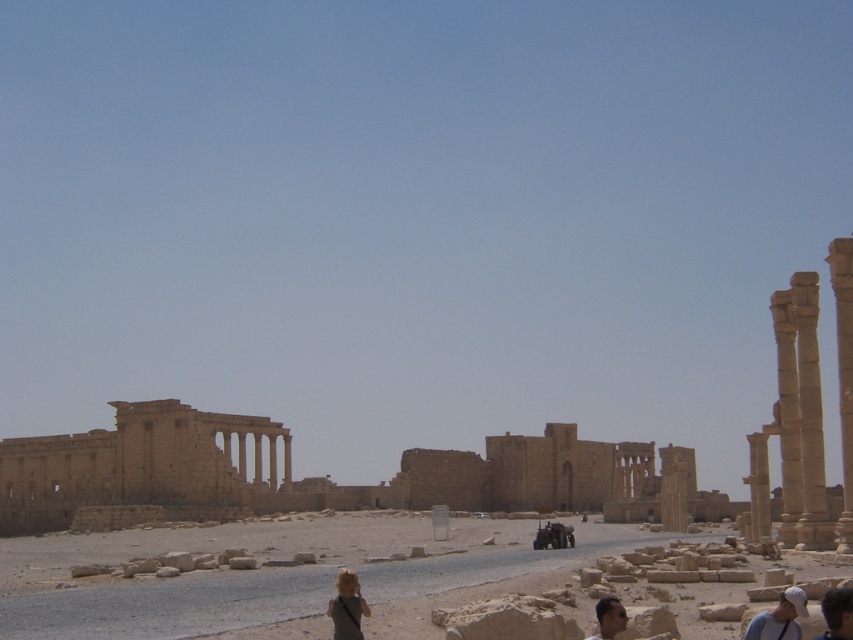
Can you confirm if beige stone ruins at left is bigger than light brown leather cap at lower right?

Yes.

Is point (120, 499) positioned behind point (750, 621)?

That is True.

The height and width of the screenshot is (640, 853). In order to click on beige stone ruins at left in this screenshot , I will do `click(137, 470)`.

Does point (770, 634) come behind point (824, 637)?

No, (770, 634) is closer to viewer.

Between light brown leather cap at lower right and dark hair at lower right, which one is positioned higher?

dark hair at lower right is above.

Does point (778, 624) come in front of point (831, 611)?

No, it is not.

Image resolution: width=853 pixels, height=640 pixels. I want to click on light brown leather cap at lower right, so [x=779, y=618].

From the picture: Which of these two, beige stone ruins at left or dark hair at lower right, stands shorter?

With less height is dark hair at lower right.

Measure the distance between beige stone ruins at left and camera.

A distance of 124.50 meters exists between beige stone ruins at left and camera.

Where is `beige stone ruins at left`? beige stone ruins at left is located at coordinates (137, 470).